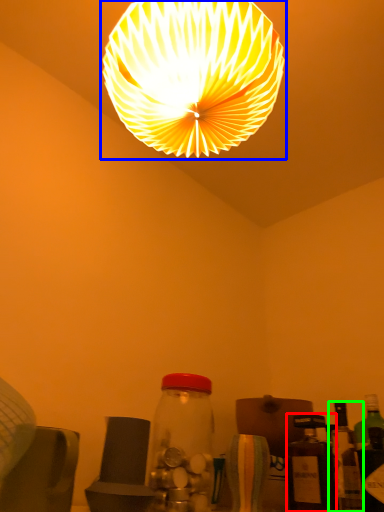
Question: Based on their relative distances, which object is nearer to bottle (highlighted by a red box)? Choose from lamp (highlighted by a blue box) and bottle (highlighted by a green box).

Choices:
 (A) lamp
 (B) bottle

Answer: (B)